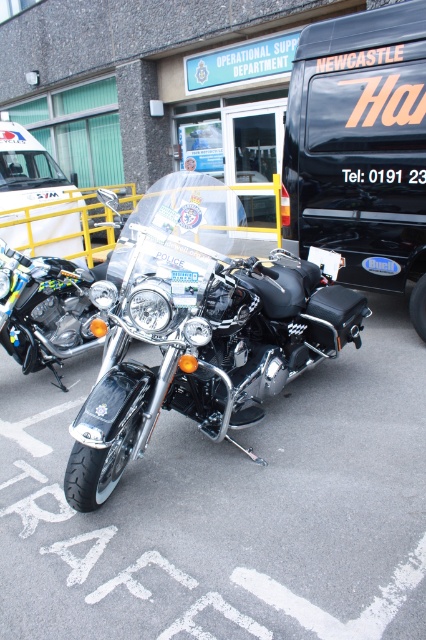
Question: Is black matte van at center bigger than shiny chrome motorcycle at center?

Choices:
 (A) yes
 (B) no

Answer: (A)

Question: Which object is positioned farthest from the polished chrome motorcycle at center?

Choices:
 (A) shiny chrome motorcycle at center
 (B) black matte van at center

Answer: (A)

Question: Which object is farther from the camera taking this photo?

Choices:
 (A) white plastic ambulance at left
 (B) shiny chrome motorcycle at center
 (C) black matte van at center
 (D) polished chrome motorcycle at center

Answer: (A)

Question: Which object is the farthest from the white plastic ambulance at left?

Choices:
 (A) black matte van at center
 (B) polished chrome motorcycle at center

Answer: (B)

Question: Can you confirm if shiny chrome motorcycle at center is positioned to the left of white plastic ambulance at left?

Choices:
 (A) no
 (B) yes

Answer: (A)

Question: Does polished chrome motorcycle at center have a lesser width compared to white plastic ambulance at left?

Choices:
 (A) no
 (B) yes

Answer: (A)